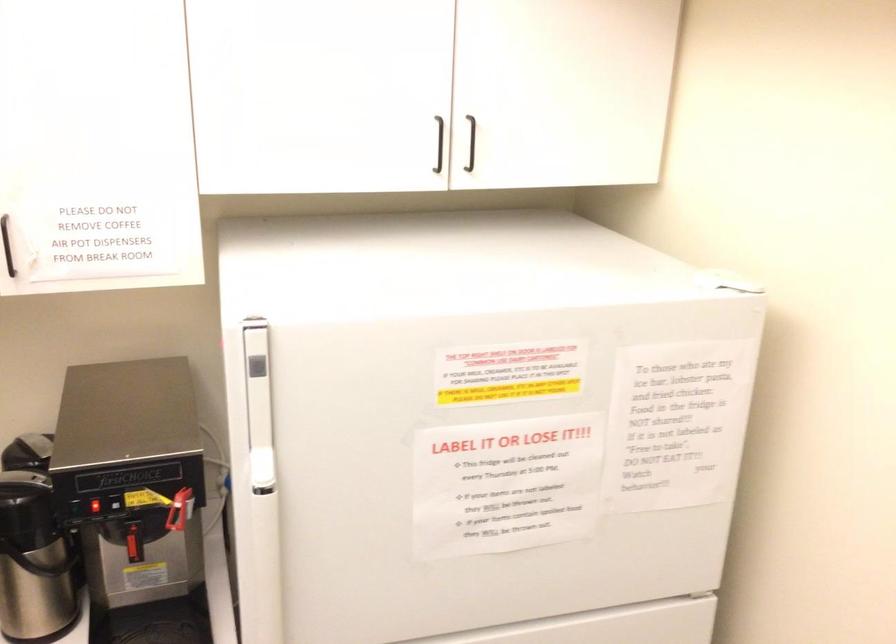
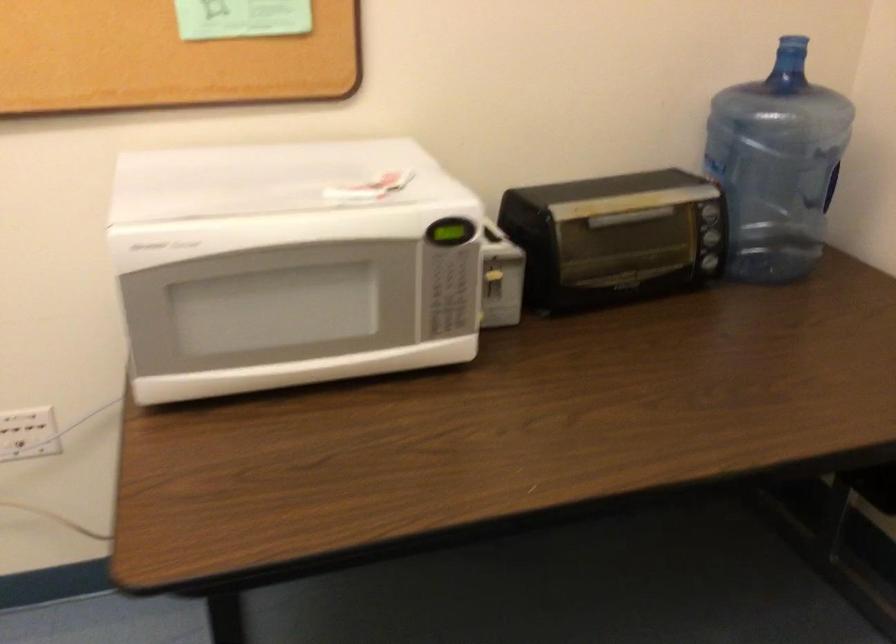
Based on the continuous images, in which direction is the camera rotating?

The camera rotated toward right-down.